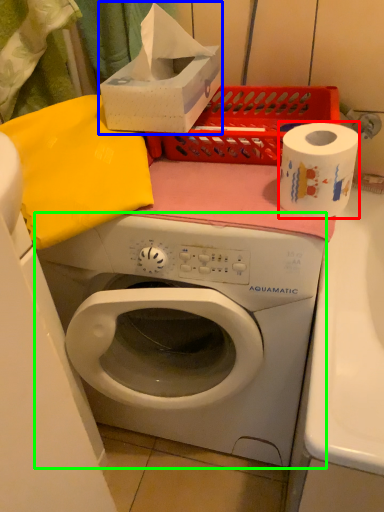
Question: Based on their relative distances, which object is farther from paper towel (highlighted by a red box)? Choose from box (highlighted by a blue box) and washing machine (highlighted by a green box).

Choices:
 (A) box
 (B) washing machine

Answer: (B)